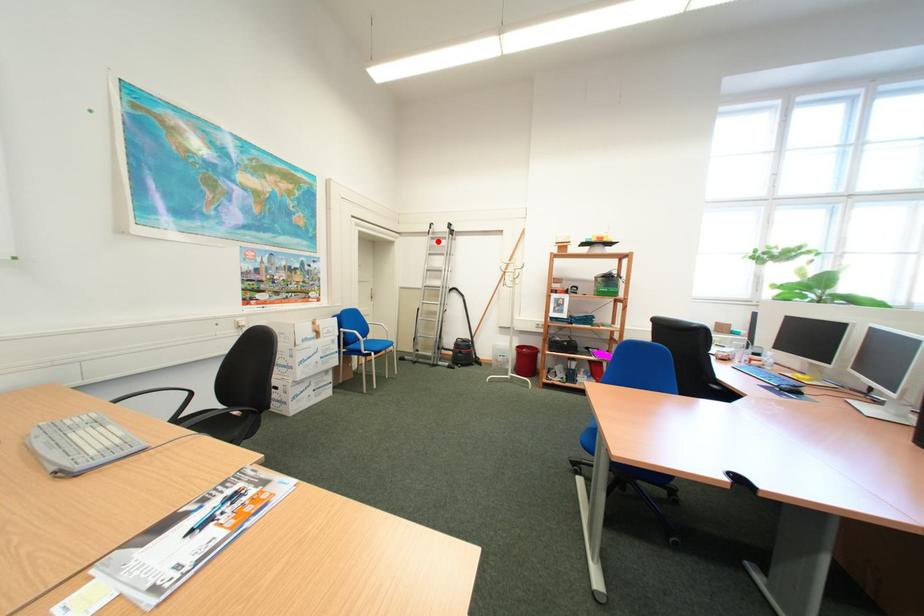
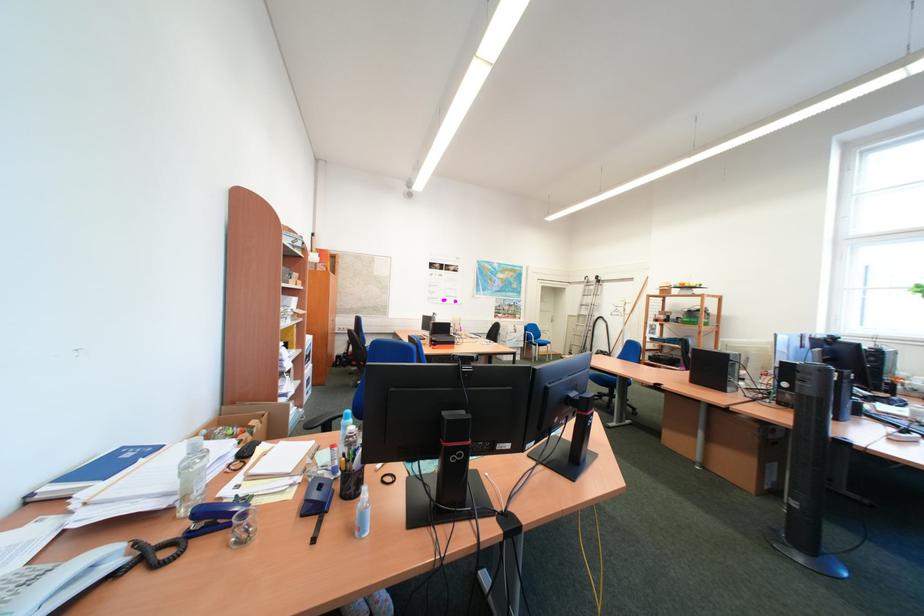
Find the pixel in the second image that matches the highlighted location in the first image.

(596, 288)